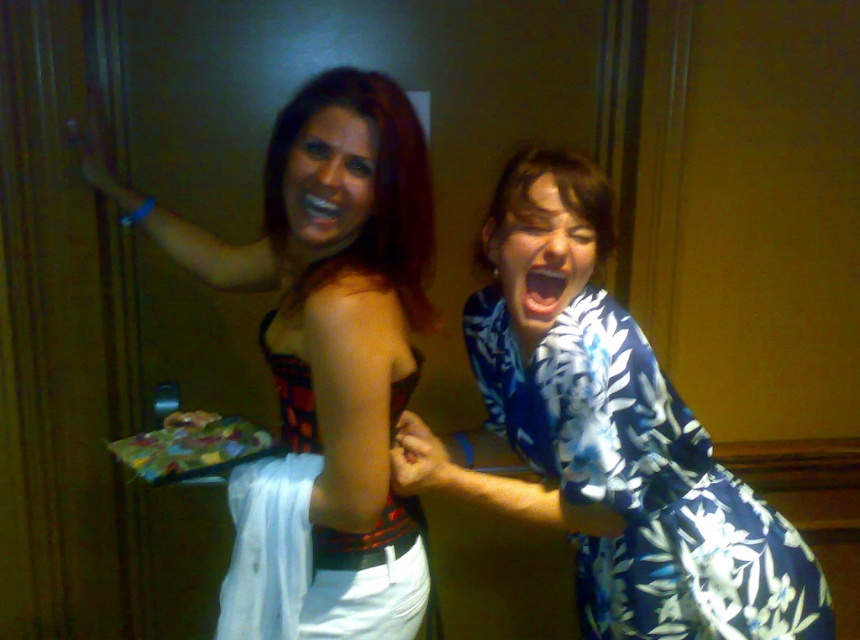
Which is behind, point (387, 516) or point (548, 273)?

Point (387, 516)

Does matte black dress at left appear over bright white teeth at center?

No, matte black dress at left is not above bright white teeth at center.

Describe the element at coordinates (336, 328) in the screenshot. I see `matte black dress at left` at that location.

This screenshot has height=640, width=860. I want to click on matte black dress at left, so click(x=336, y=328).

Can you confirm if matte black dress at left is shorter than red plaid fabric dress at center?

Incorrect, matte black dress at left's height does not fall short of red plaid fabric dress at center's.

Does point (327, 509) come farther from viewer compared to point (306, 387)?

No, (327, 509) is closer to viewer.

The height and width of the screenshot is (640, 860). What are the coordinates of `matte black dress at left` in the screenshot? It's located at (336, 328).

At what (x,y) coordinates should I click in order to perform the action: click on matte black dress at left. Please return your answer as a coordinate pair (x, y). The image size is (860, 640). Looking at the image, I should click on (336, 328).

Describe the element at coordinates (314, 540) in the screenshot. I see `red plaid fabric dress at center` at that location.

Can you confirm if red plaid fabric dress at center is positioned to the right of bright white teeth at center?

No, red plaid fabric dress at center is not to the right of bright white teeth at center.

Who is more forward, (x=293, y=564) or (x=531, y=289)?

Point (x=293, y=564) is more forward.

This screenshot has width=860, height=640. I want to click on red plaid fabric dress at center, so click(314, 540).